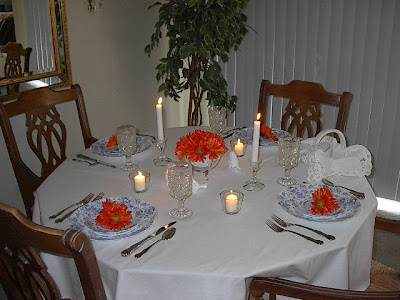
Image resolution: width=400 pixels, height=300 pixels. I want to click on plates in the image, so click(x=90, y=224), click(x=92, y=234), click(x=110, y=149), click(x=101, y=151), click(x=264, y=139), click(x=267, y=142), click(x=302, y=200), click(x=287, y=197).